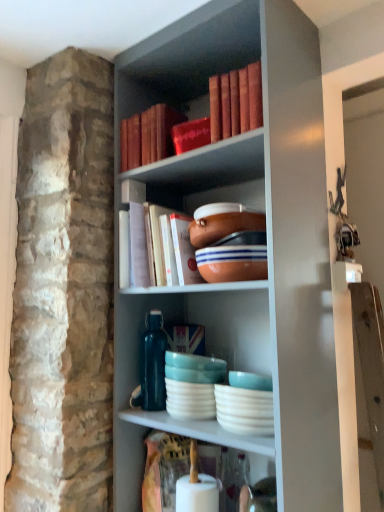
Question: Is matte orange bowl at center, positioned as the 2th bowl in top-to-bottom order, further to camera compared to hardcover book at center, acting as the first book starting from the bottom?

Choices:
 (A) yes
 (B) no

Answer: (B)

Question: Does matte orange bowl at center, positioned as the 1th bowl in bottom-to-top order, appear on the right side of hardcover book at center, acting as the first book starting from the bottom?

Choices:
 (A) no
 (B) yes

Answer: (B)

Question: Considering the relative sizes of matte orange bowl at center, positioned as the 2th bowl in top-to-bottom order, and hardcover book at center, the second book positioned from the top, in the image provided, is matte orange bowl at center, positioned as the 2th bowl in top-to-bottom order, smaller than hardcover book at center, the second book positioned from the top,?

Choices:
 (A) yes
 (B) no

Answer: (A)

Question: From the image's perspective, is matte orange bowl at center, positioned as the 1th bowl in bottom-to-top order, under hardcover book at center, acting as the first book starting from the bottom?

Choices:
 (A) no
 (B) yes

Answer: (B)

Question: Does matte orange bowl at center, positioned as the 2th bowl in top-to-bottom order, have a greater width compared to hardcover book at center, the second book positioned from the top?

Choices:
 (A) yes
 (B) no

Answer: (B)

Question: From the image's perspective, is matte white ceramic plates at center above or below matte orange bowl at center, the 1th bowl positioned from the top?

Choices:
 (A) above
 (B) below

Answer: (B)

Question: In the image, is matte white ceramic plates at center on the left side or the right side of matte orange bowl at center, positioned as the 2th bowl in bottom-to-top order?

Choices:
 (A) left
 (B) right

Answer: (A)

Question: Does point (215, 372) appear closer or farther from the camera than point (216, 217)?

Choices:
 (A) farther
 (B) closer

Answer: (A)

Question: Considering the positions of matte white ceramic plates at center and matte orange bowl at center, the 1th bowl positioned from the top, in the image, is matte white ceramic plates at center bigger or smaller than matte orange bowl at center, the 1th bowl positioned from the top,?

Choices:
 (A) big
 (B) small

Answer: (A)

Question: Is point (205, 371) closer or farther from the camera than point (249, 280)?

Choices:
 (A) farther
 (B) closer

Answer: (A)

Question: Looking at their shapes, would you say matte white ceramic plates at center is wider or thinner than matte orange bowl at center, positioned as the 1th bowl in bottom-to-top order?

Choices:
 (A) wide
 (B) thin

Answer: (A)

Question: In the image, is matte white ceramic plates at center positioned in front of or behind matte orange bowl at center, positioned as the 2th bowl in top-to-bottom order?

Choices:
 (A) front
 (B) behind

Answer: (B)

Question: From the image's perspective, is matte white ceramic plates at center above or below matte orange bowl at center, positioned as the 1th bowl in bottom-to-top order?

Choices:
 (A) below
 (B) above

Answer: (A)

Question: Which is correct: matte white ceramic plates at center is inside matte red book at upper center, the 2th book from the bottom, or outside of it?

Choices:
 (A) outside
 (B) inside

Answer: (A)

Question: Considering the positions of matte white ceramic plates at center and matte red book at upper center, the first book when ordered from top to bottom, in the image, is matte white ceramic plates at center wider or thinner than matte red book at upper center, the first book when ordered from top to bottom,?

Choices:
 (A) wide
 (B) thin

Answer: (A)